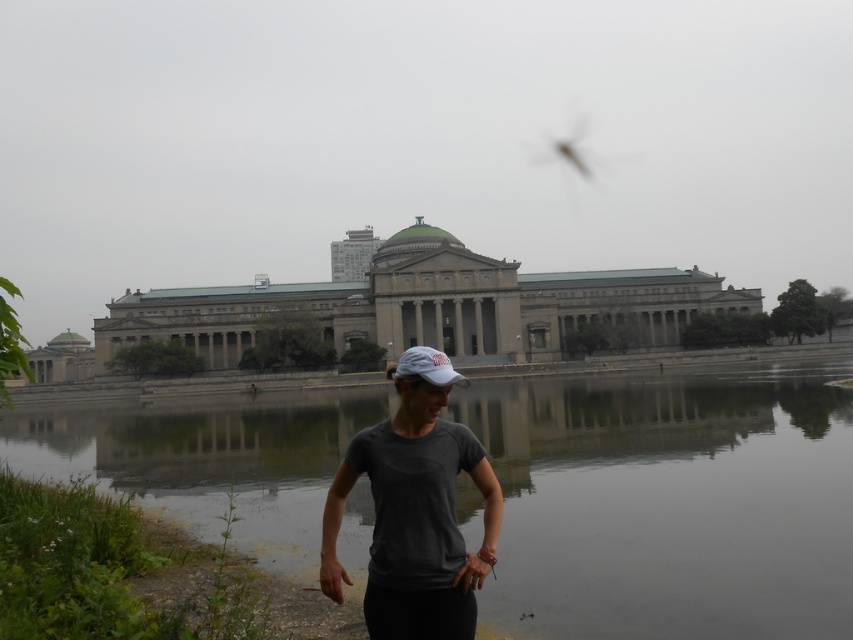
Question: Which point is farther to the camera?

Choices:
 (A) dark gray matte t-shirt at center
 (B) gray stone building at center
 (C) clear water at lower center
 (D) white matte baseball cap at center

Answer: (B)

Question: Among these points, which one is nearest to the camera?

Choices:
 (A) (418, 372)
 (B) (383, 605)
 (C) (660, 397)

Answer: (B)

Question: Does clear water at lower center appear on the right side of dark gray matte t-shirt at center?

Choices:
 (A) no
 (B) yes

Answer: (A)

Question: Can you confirm if clear water at lower center is positioned below gray stone building at center?

Choices:
 (A) no
 (B) yes

Answer: (B)

Question: Which point is closer to the camera taking this photo?

Choices:
 (A) (167, 442)
 (B) (454, 384)
 (C) (543, 358)
 (D) (436, 371)

Answer: (D)

Question: Does dark gray matte t-shirt at center appear on the right side of white matte baseball cap at center?

Choices:
 (A) no
 (B) yes

Answer: (A)